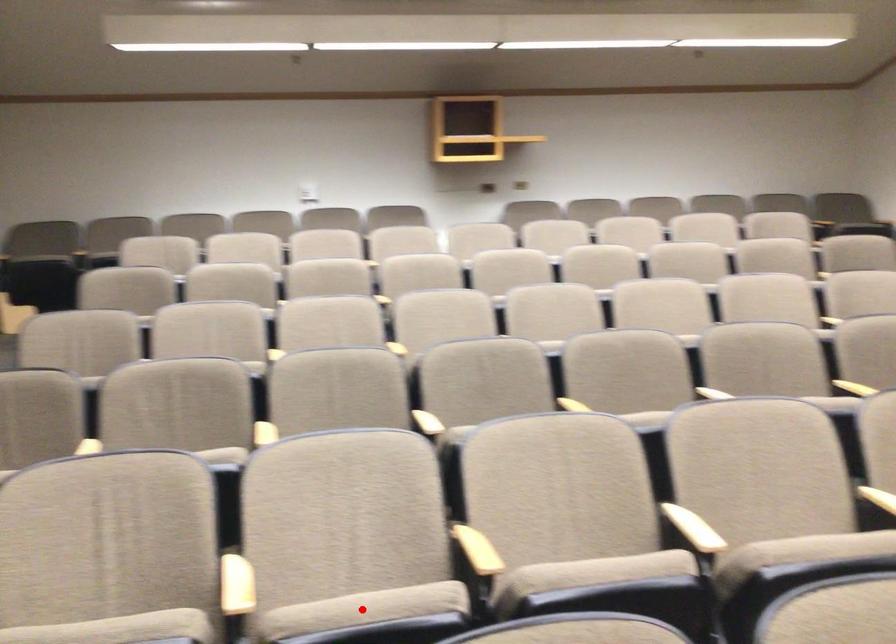
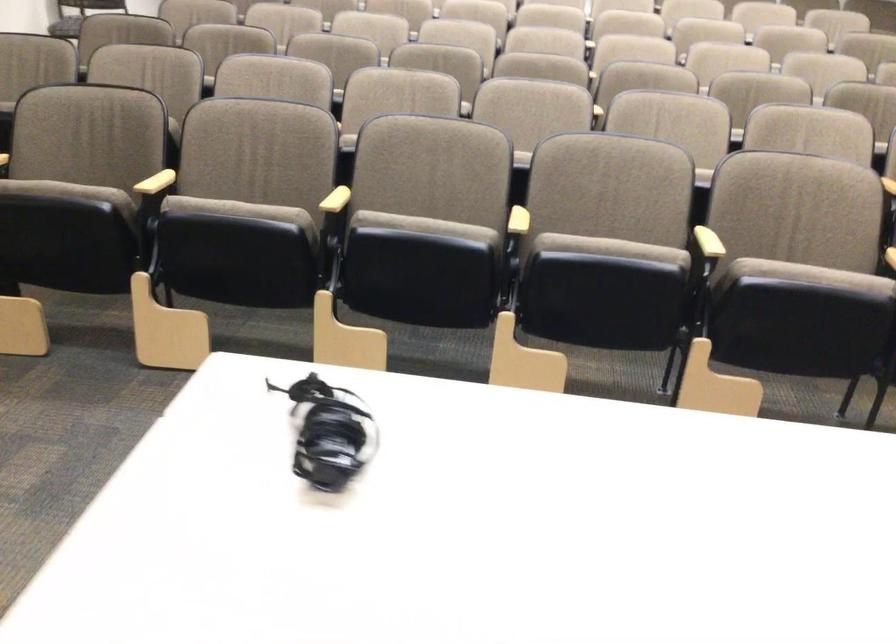
Question: I am providing you with two images of the same scene from different viewpoints. A red point is marked on the first image. Can you still see the location of the red point in image 2?

Choices:
 (A) Yes
 (B) No

Answer: (B)